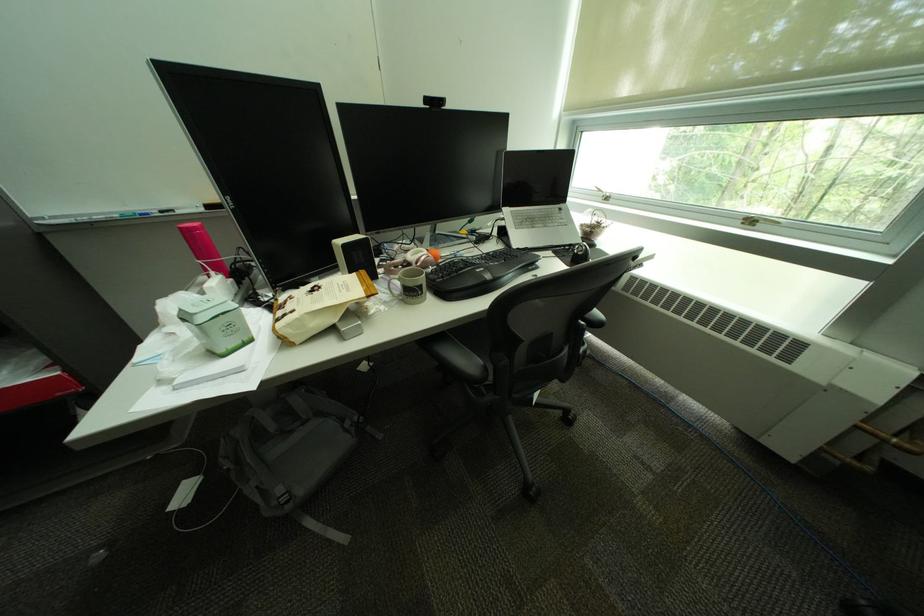
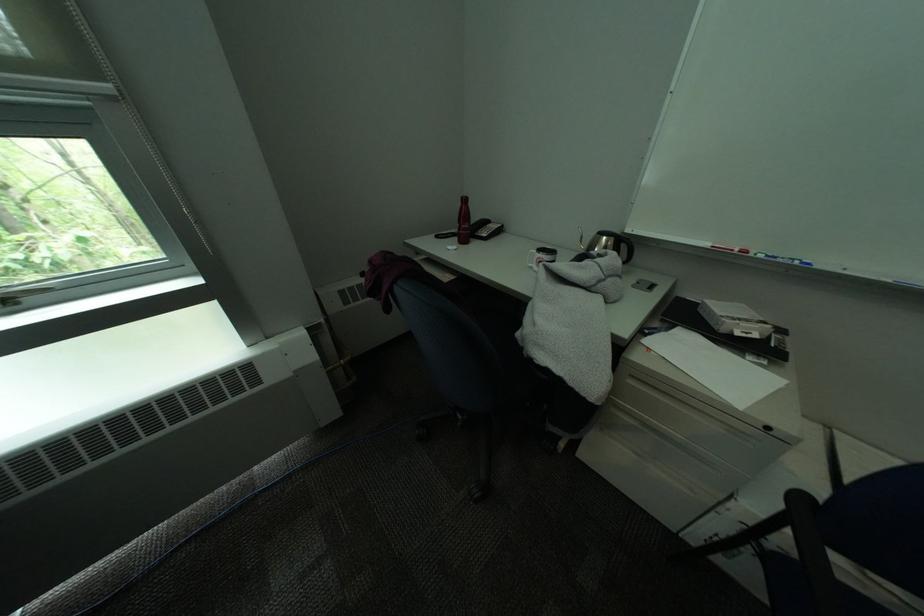
The first image is from the beginning of the video and the second image is from the end. How did the camera likely rotate when shooting the video?

The camera's rotation is toward right-down.